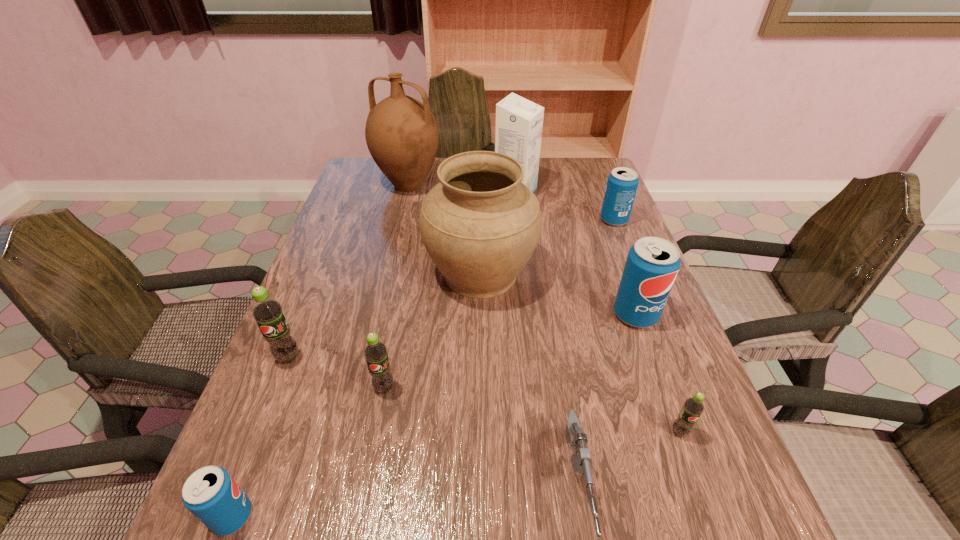
Image resolution: width=960 pixels, height=540 pixels. In order to click on object that is the closest to the third farthest object in this screenshot , I will do `click(519, 122)`.

At what (x,y) coordinates should I click in order to perform the action: click on soda can that stands as the fourth closest to the carton. Please return your answer as a coordinate pair (x, y). Looking at the image, I should click on (267, 311).

Where is `soda can object that ranks as the third closest to the nearest blue soda can`? This screenshot has width=960, height=540. soda can object that ranks as the third closest to the nearest blue soda can is located at coordinates (693, 407).

Identify the location of blue soda can that is the closest one to the third farthest object. (652, 264).

Locate which blue soda can is the second closest to the biggest blue soda can. Please provide its 2D coordinates. Your answer should be formatted as a tuple, i.e. [(x, y)], where the tuple contains the x and y coordinates of a point satisfying the conditions above.

[(211, 494)]

Identify which green soda is the closest to the smallest blue soda can. Please provide its 2D coordinates. Your answer should be formatted as a tuple, i.e. [(x, y)], where the tuple contains the x and y coordinates of a point satisfying the conditions above.

[(375, 352)]

Locate which green soda ranks in proximity to the fourth nearest object. Please provide its 2D coordinates. Your answer should be formatted as a tuple, i.e. [(x, y)], where the tuple contains the x and y coordinates of a point satisfying the conditions above.

[(267, 311)]